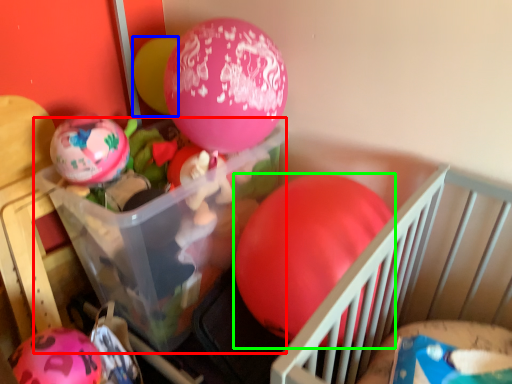
Question: Which object is the farthest from storage box (highlighted by a red box)? Choose among these: balloon (highlighted by a blue box) or balloon (highlighted by a green box).

Choices:
 (A) balloon
 (B) balloon

Answer: (A)